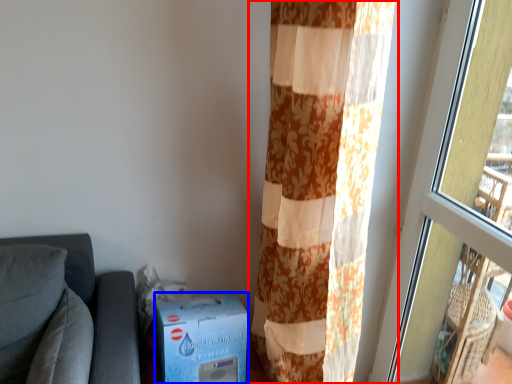
Question: Which of the following is the closest to the observer, curtain (highlighted by a red box) or cardboard box (highlighted by a blue box)?

Choices:
 (A) curtain
 (B) cardboard box

Answer: (A)